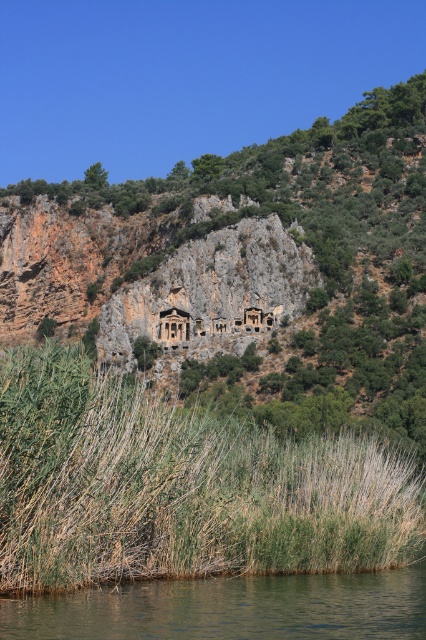
You are standing at the base of the rocky hillside and looking towards the carved structures. There are two points marked on the image. The first point is at coordinate (x=60, y=346) and the second is at (x=227, y=577). Which point is closer to you?

Point (x=227, y=577) is closer to you because point (x=60, y=346) is behind it.

You are a hiker standing at the base of the rocky hillside. You notice a green grassy reed at lower center and a matte stone tomb at center. Which object is closer to you?

The green grassy reed at lower center is closer to you because it is in front of the matte stone tomb at center.